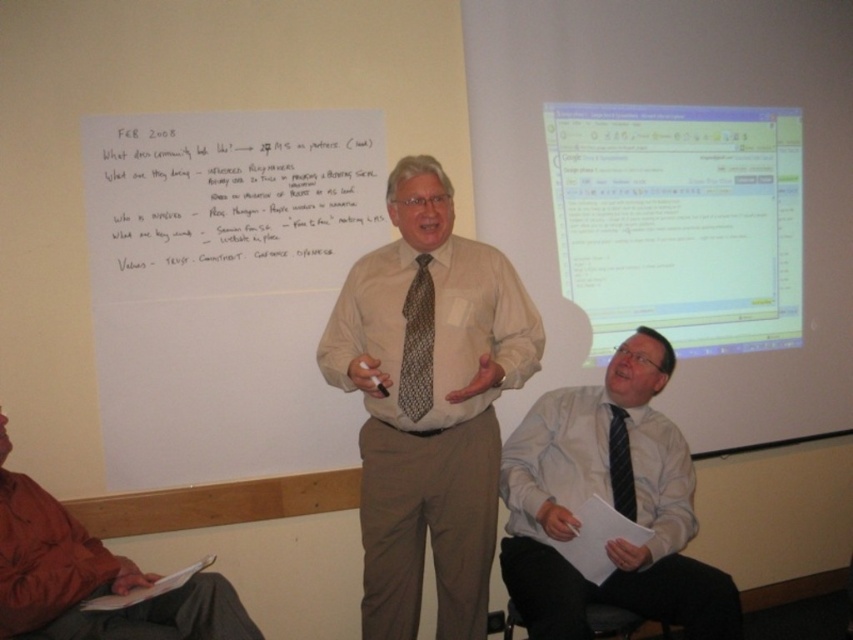
Question: Which point is closer to the camera taking this photo?

Choices:
 (A) (422, 260)
 (B) (120, 164)
 (C) (120, 451)

Answer: (A)

Question: Which point is closer to the camera?

Choices:
 (A) (509, 595)
 (B) (244, 259)
 (C) (141, 230)

Answer: (A)

Question: Which object is farther from the camera taking this photo?

Choices:
 (A) brown cotton jacket at lower left
 (B) white shirt at center
 (C) light brown shirt at center
 (D) matte white screen at upper right

Answer: (D)

Question: Can you confirm if matte white screen at upper right is positioned below white paper at upper center?

Choices:
 (A) yes
 (B) no

Answer: (A)

Question: Considering the relative positions of brown cotton jacket at lower left and brown textured tie at center in the image provided, where is brown cotton jacket at lower left located with respect to brown textured tie at center?

Choices:
 (A) right
 (B) left

Answer: (B)

Question: Where is light brown shirt at center located in relation to white shirt at center in the image?

Choices:
 (A) right
 (B) left

Answer: (B)